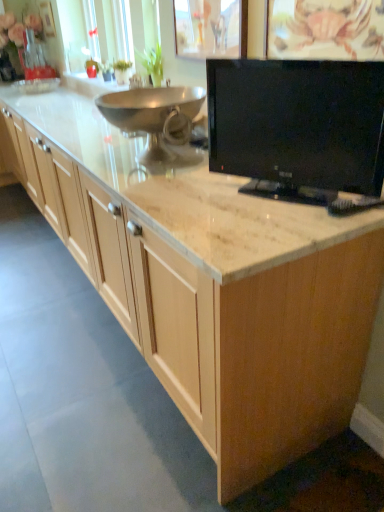
Question: From the image's perspective, does satin nickel faucet at upper center appear lower than black glossy tv at upper right?

Choices:
 (A) yes
 (B) no

Answer: (B)

Question: Could you tell me if satin nickel faucet at upper center is facing black glossy tv at upper right?

Choices:
 (A) no
 (B) yes

Answer: (A)

Question: Is satin nickel faucet at upper center wider than black glossy tv at upper right?

Choices:
 (A) yes
 (B) no

Answer: (B)

Question: Is satin nickel faucet at upper center looking in the opposite direction of black glossy tv at upper right?

Choices:
 (A) yes
 (B) no

Answer: (B)

Question: Is the position of satin nickel faucet at upper center more distant than that of black glossy tv at upper right?

Choices:
 (A) no
 (B) yes

Answer: (B)

Question: Do you think black glossy tv at upper right is within satin nickel faucet at upper center, or outside of it?

Choices:
 (A) outside
 (B) inside

Answer: (A)

Question: Is black glossy tv at upper right in front of or behind satin nickel faucet at upper center in the image?

Choices:
 (A) front
 (B) behind

Answer: (A)

Question: From their relative heights in the image, would you say black glossy tv at upper right is taller or shorter than satin nickel faucet at upper center?

Choices:
 (A) short
 (B) tall

Answer: (B)

Question: Is point (349, 114) positioned closer to the camera than point (140, 81)?

Choices:
 (A) farther
 (B) closer

Answer: (B)

Question: Considering the positions of point (135, 80) and point (284, 180), is point (135, 80) closer or farther from the camera than point (284, 180)?

Choices:
 (A) closer
 (B) farther

Answer: (B)

Question: Choose the correct answer: Is satin nickel faucet at upper center inside black glossy tv at upper right or outside it?

Choices:
 (A) inside
 (B) outside

Answer: (B)

Question: Considering their positions, is satin nickel faucet at upper center located in front of or behind black glossy tv at upper right?

Choices:
 (A) behind
 (B) front

Answer: (A)

Question: From a real-world perspective, relative to black glossy tv at upper right, is satin nickel faucet at upper center vertically above or below?

Choices:
 (A) above
 (B) below

Answer: (B)

Question: In terms of size, does black glossy tv at upper right appear bigger or smaller than polished stainless steel bowl at center?

Choices:
 (A) big
 (B) small

Answer: (B)

Question: From a real-world perspective, relative to polished stainless steel bowl at center, is black glossy tv at upper right vertically above or below?

Choices:
 (A) above
 (B) below

Answer: (A)